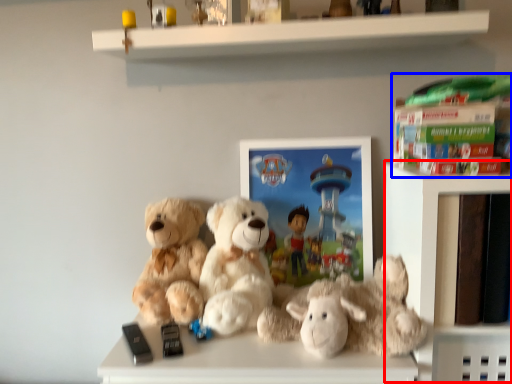
Question: Which object appears farthest to the camera in this image, shelf (highlighted by a red box) or book (highlighted by a blue box)?

Choices:
 (A) shelf
 (B) book

Answer: (A)